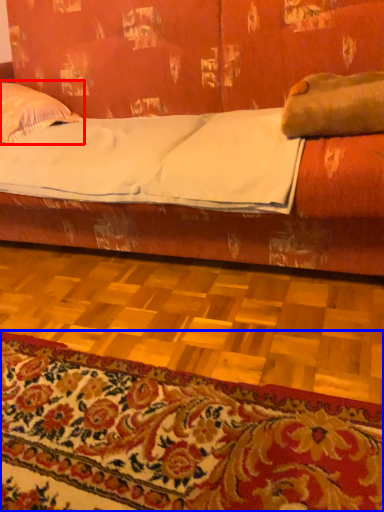
Question: Which object appears farthest to the camera in this image, pillow (highlighted by a red box) or mat (highlighted by a blue box)?

Choices:
 (A) pillow
 (B) mat

Answer: (A)